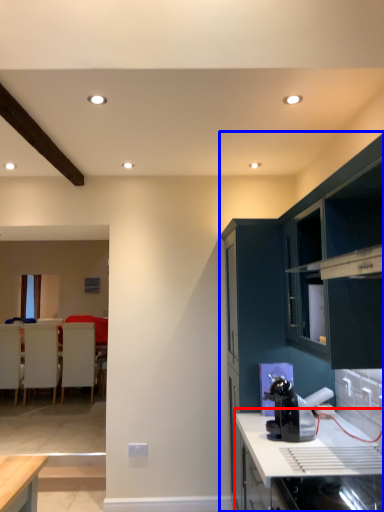
Question: Which point is closer to the camera, countertop (highlighted by a red box) or cabinetry (highlighted by a blue box)?

Choices:
 (A) countertop
 (B) cabinetry

Answer: (A)